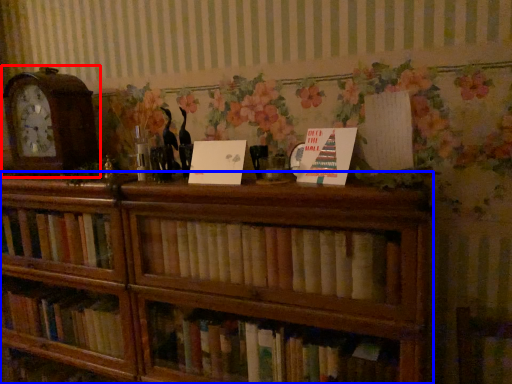
Question: Which object appears farthest to the camera in this image, alarm clock (highlighted by a red box) or bookcase (highlighted by a blue box)?

Choices:
 (A) alarm clock
 (B) bookcase

Answer: (A)